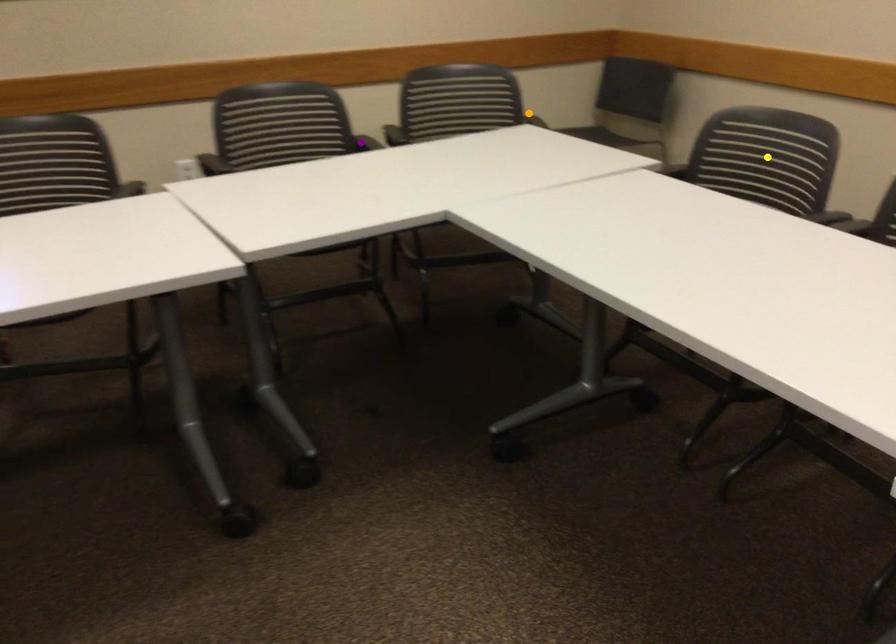
Based on the photo, order these from nearest to farthest:
orange point, purple point, yellow point

orange point
purple point
yellow point